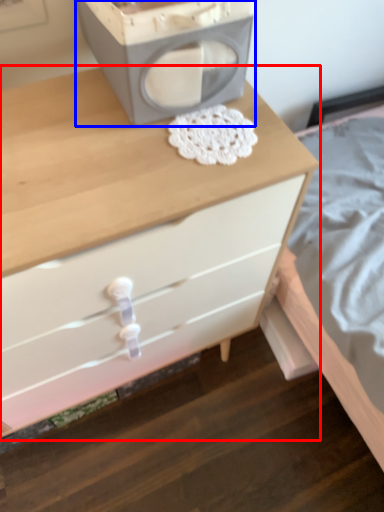
Question: Which object is closer to the camera taking this photo, chest of drawers (highlighted by a red box) or appliance (highlighted by a blue box)?

Choices:
 (A) chest of drawers
 (B) appliance

Answer: (A)